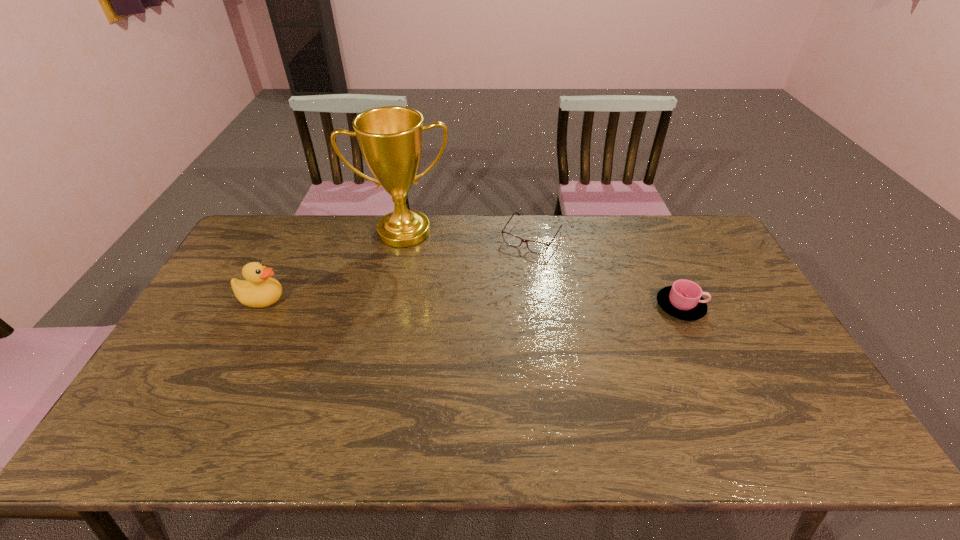
Locate an element on the screen. The height and width of the screenshot is (540, 960). vacant area between the duck and the shortest object is located at coordinates (396, 268).

Locate an element on the screen. The height and width of the screenshot is (540, 960). empty space that is in between the shortest object and the duck is located at coordinates (396, 268).

Where is `free space between the third tallest object and the tallest object`? free space between the third tallest object and the tallest object is located at coordinates (542, 269).

What are the coordinates of `vacant space that's between the leftmost object and the second object from right to left` in the screenshot? It's located at (396, 268).

I want to click on vacant area between the duck and the second shortest object, so click(471, 303).

Locate an element on the screen. The image size is (960, 540). object that is the second nearest to the duck is located at coordinates 534,246.

What are the coordinates of `the closest object to the shortest object` in the screenshot? It's located at (390, 138).